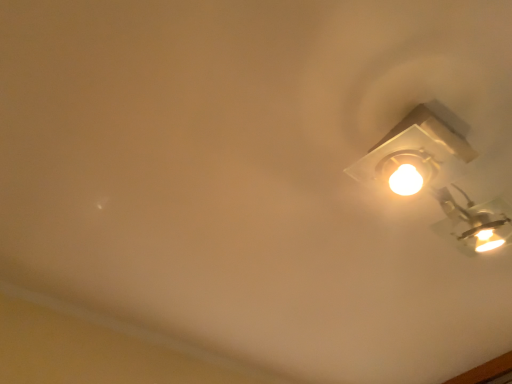
What do you see at coordinates (436, 175) in the screenshot? The image size is (512, 384). I see `white plastic lamp at upper right` at bounding box center [436, 175].

What are the coordinates of `white plastic lamp at upper right` in the screenshot? It's located at (436, 175).

At what (x,y) coordinates should I click in order to perform the action: click on white plastic lamp at upper right. Please return your answer as a coordinate pair (x, y). The width and height of the screenshot is (512, 384). Looking at the image, I should click on (436, 175).